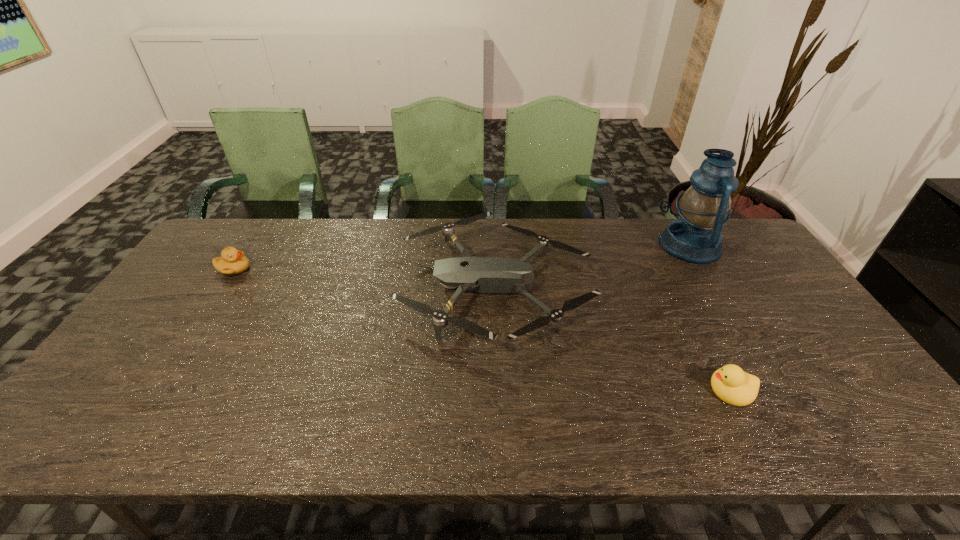
Locate an element on the screen. This screenshot has width=960, height=540. free space between the lantern and the nearest object is located at coordinates (710, 318).

Where is `empty location between the farther duckling and the drone`? The height and width of the screenshot is (540, 960). empty location between the farther duckling and the drone is located at coordinates (365, 278).

Locate an element on the screen. The width and height of the screenshot is (960, 540). vacant space that's between the farther duckling and the second object from left to right is located at coordinates (365, 278).

Locate an element on the screen. The image size is (960, 540). free point between the drone and the farther duckling is located at coordinates (365, 278).

Find the location of a particular element. The image size is (960, 540). vacant space in between the nearest object and the tallest object is located at coordinates (710, 318).

Image resolution: width=960 pixels, height=540 pixels. Identify the location of vacant region between the tallest object and the third object from right to left. (593, 266).

Locate which object ranks third in proximity to the farther duckling. Please provide its 2D coordinates. Your answer should be formatted as a tuple, i.e. [(x, y)], where the tuple contains the x and y coordinates of a point satisfying the conditions above.

[(695, 237)]

Locate which object is the second closest to the right duckling. Please provide its 2D coordinates. Your answer should be formatted as a tuple, i.e. [(x, y)], where the tuple contains the x and y coordinates of a point satisfying the conditions above.

[(695, 237)]